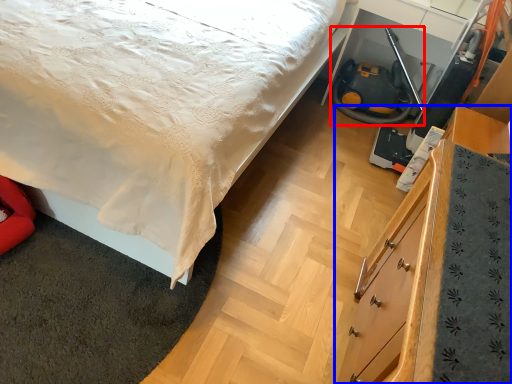
Question: Which object is further to the camera taking this photo, fire hose (highlighted by a red box) or chest of drawers (highlighted by a blue box)?

Choices:
 (A) fire hose
 (B) chest of drawers

Answer: (A)